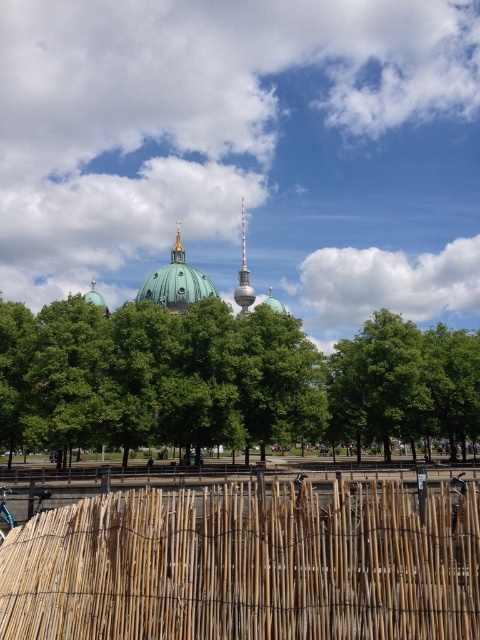
Question: Among these objects, which one is farthest from the camera?

Choices:
 (A) silver metallic spire at center
 (B) green leafy tree at center

Answer: (A)

Question: Which of these objects is positioned farthest from the silver metallic spire at center?

Choices:
 (A) green matte dome at center
 (B) bamboo mat at center

Answer: (B)

Question: Among these objects, which one is nearest to the camera?

Choices:
 (A) green matte dome at center
 (B) silver metallic spire at center
 (C) bamboo mat at center

Answer: (C)

Question: Can you confirm if bamboo mat at center is positioned to the left of silver metallic spire at center?

Choices:
 (A) yes
 (B) no

Answer: (B)

Question: Considering the relative positions of bamboo mat at center and gold plated spire at center in the image provided, where is bamboo mat at center located with respect to gold plated spire at center?

Choices:
 (A) right
 (B) left

Answer: (A)

Question: Is silver metallic spire at center below gold plated spire at center?

Choices:
 (A) no
 (B) yes

Answer: (B)